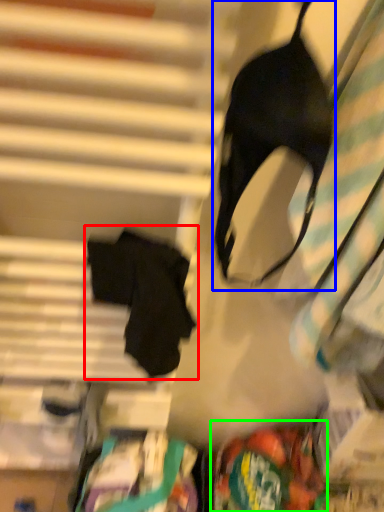
Question: Which is nearer to the robe (highlighted by a red box)? brassiere (highlighted by a blue box) or waste (highlighted by a green box).

Choices:
 (A) brassiere
 (B) waste

Answer: (A)